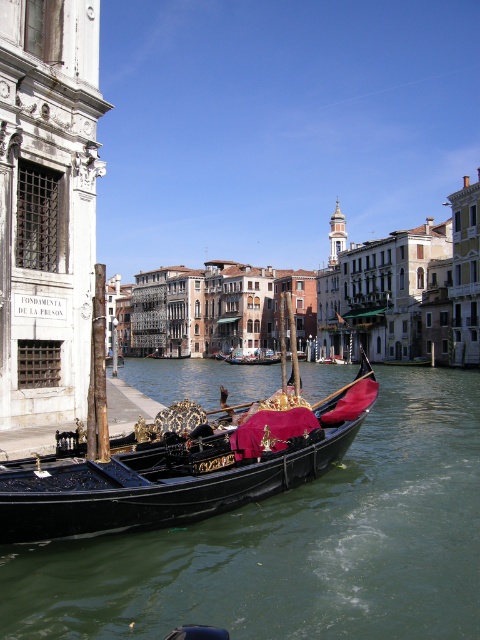
Is green water at gondola center wider than black velvet gondola at center?

Yes, green water at gondola center is wider than black velvet gondola at center.

Can you confirm if green water at gondola center is thinner than black velvet gondola at center?

Incorrect, green water at gondola center's width is not less than black velvet gondola at center's.

Is point (216, 612) positioned in front of point (241, 356)?

Yes, point (216, 612) is closer to viewer.

The height and width of the screenshot is (640, 480). Find the location of `green water at gondola center`. green water at gondola center is located at coordinates (294, 545).

Is point (51, 589) behind point (262, 417)?

No, (51, 589) is closer to viewer.

Based on the photo, between green water at gondola center and black polished gondola at lower left, which one has less height?

black polished gondola at lower left

Does point (191, 378) come in front of point (186, 467)?

No, it is not.

Image resolution: width=480 pixels, height=640 pixels. Find the location of `green water at gondola center`. green water at gondola center is located at coordinates (294, 545).

Who is higher up, black polished gondola at lower left or black velvet gondola at center?

black polished gondola at lower left is above.

Where is `black polished gondola at lower left`? This screenshot has height=640, width=480. black polished gondola at lower left is located at coordinates (180, 467).

Between point (208, 429) and point (257, 360), which one is positioned behind?

The point (257, 360) is behind.

Locate an element on the screen. The height and width of the screenshot is (640, 480). black polished gondola at lower left is located at coordinates (180, 467).